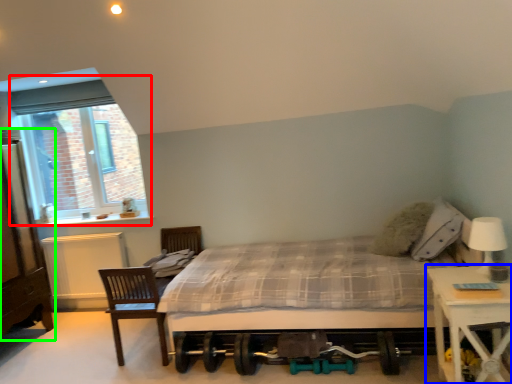
Question: Which object is positioned farthest from window (highlighted by a red box)? Select from nightstand (highlighted by a blue box) and dresser (highlighted by a green box).

Choices:
 (A) nightstand
 (B) dresser

Answer: (A)